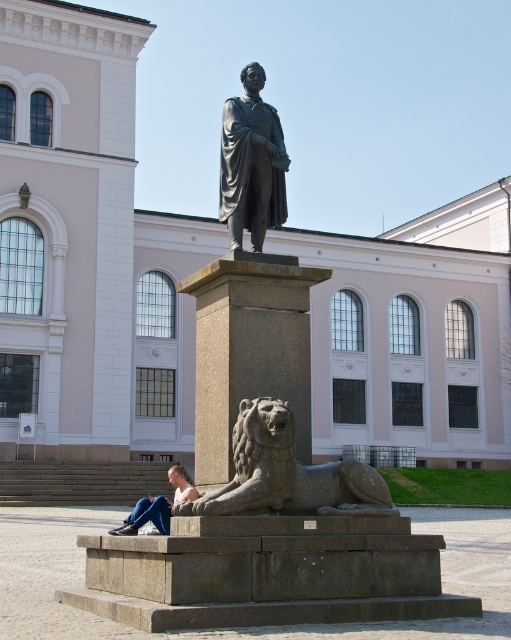
Question: Can you confirm if bronze statue at center is smaller than skinny jeans at lower left?

Choices:
 (A) yes
 (B) no

Answer: (A)

Question: Is granite lion at lower center smaller than bronze statue at center?

Choices:
 (A) yes
 (B) no

Answer: (A)

Question: Is granite lion at lower center behind skinny jeans at lower left?

Choices:
 (A) no
 (B) yes

Answer: (A)

Question: Which of the following is the closest to the observer?

Choices:
 (A) (228, 141)
 (B) (124, 525)
 (C) (236, 435)

Answer: (C)

Question: Among these points, which one is nearest to the camera?

Choices:
 (A) (239, 138)
 (B) (290, 477)

Answer: (B)

Question: Estimate the real-world distances between objects in this image. Which object is closer to the bronze statue at center?

Choices:
 (A) skinny jeans at lower left
 (B) granite lion at lower center

Answer: (B)